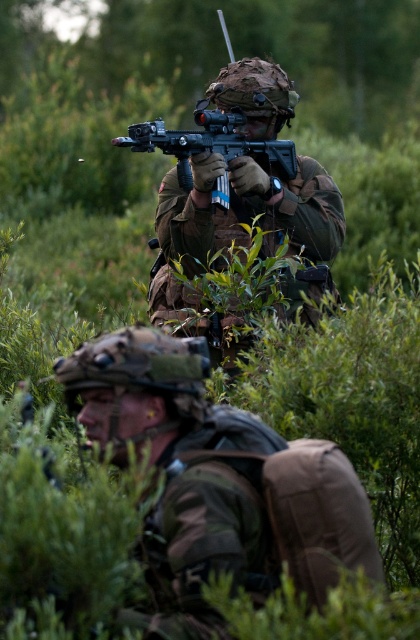
Does camouflage fabric uniform at center appear over matte black rifle at center?

No.

Image resolution: width=420 pixels, height=640 pixels. Describe the element at coordinates (238, 220) in the screenshot. I see `camouflage fabric uniform at center` at that location.

Is point (260, 225) more distant than point (178, 182)?

Yes, it is.

At what (x,y) coordinates should I click in order to perform the action: click on camouflage fabric uniform at center. Please return your answer as a coordinate pair (x, y). This screenshot has width=420, height=640. Looking at the image, I should click on coord(238,220).